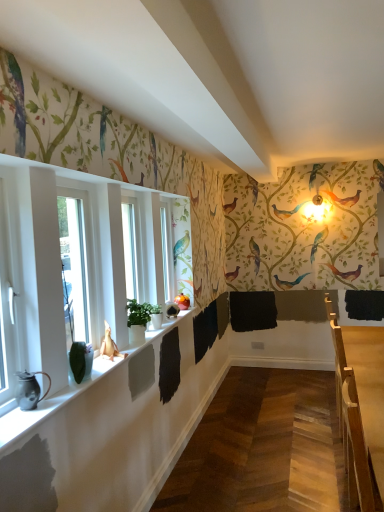
Question: Is green matte plant at left to the right of wooden table at right from the viewer's perspective?

Choices:
 (A) no
 (B) yes

Answer: (A)

Question: From a real-world perspective, is green matte plant at left below wooden table at right?

Choices:
 (A) no
 (B) yes

Answer: (A)

Question: Does green matte plant at left touch wooden table at right?

Choices:
 (A) no
 (B) yes

Answer: (A)

Question: Is green matte plant at left at the left side of wooden table at right?

Choices:
 (A) yes
 (B) no

Answer: (A)

Question: Would you say green matte plant at left is a long distance from wooden table at right?

Choices:
 (A) yes
 (B) no

Answer: (A)

Question: Is matte white window sill at lower left taller or shorter than white glossy window at left?

Choices:
 (A) tall
 (B) short

Answer: (B)

Question: Is matte white window sill at lower left wider or thinner than white glossy window at left?

Choices:
 (A) wide
 (B) thin

Answer: (A)

Question: Considering the positions of matte white window sill at lower left and white glossy window at left in the image, is matte white window sill at lower left bigger or smaller than white glossy window at left?

Choices:
 (A) big
 (B) small

Answer: (B)

Question: Is matte white window sill at lower left in front of or behind white glossy window at left in the image?

Choices:
 (A) behind
 (B) front

Answer: (B)

Question: In the image, is green matte plant at left positioned in front of or behind wooden table at right?

Choices:
 (A) front
 (B) behind

Answer: (B)

Question: Would you say green matte plant at left is inside or outside wooden table at right?

Choices:
 (A) inside
 (B) outside

Answer: (B)

Question: Considering the positions of green matte plant at left and wooden table at right in the image, is green matte plant at left taller or shorter than wooden table at right?

Choices:
 (A) short
 (B) tall

Answer: (A)

Question: From the image's perspective, is green matte plant at left above or below wooden table at right?

Choices:
 (A) below
 (B) above

Answer: (B)

Question: Considering the positions of white glossy window at left and wooden table at right in the image, is white glossy window at left taller or shorter than wooden table at right?

Choices:
 (A) short
 (B) tall

Answer: (A)

Question: Which is correct: white glossy window at left is inside wooden table at right, or outside of it?

Choices:
 (A) inside
 (B) outside

Answer: (B)